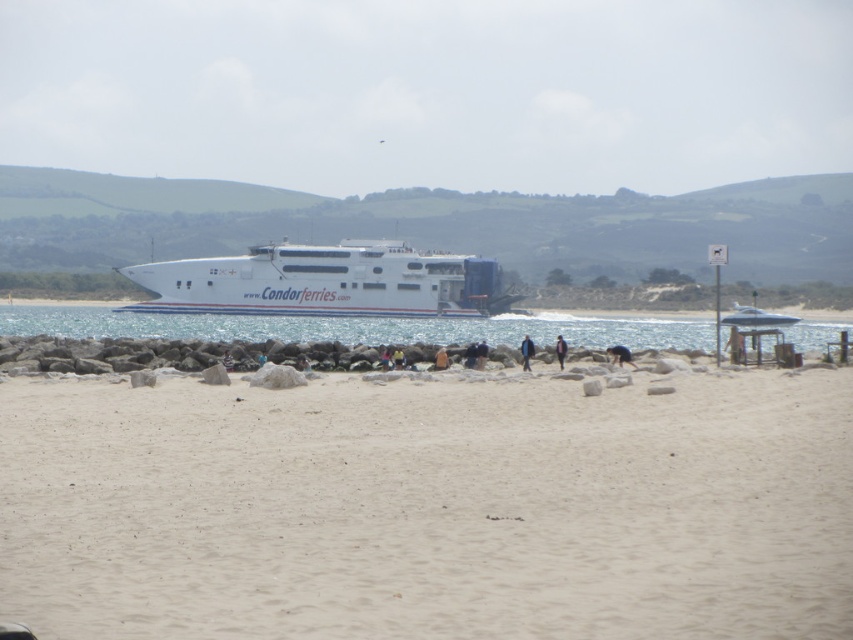
Locate an element on the screen. The height and width of the screenshot is (640, 853). white glossy cruise ship at center is located at coordinates (326, 282).

Between point (344, 252) and point (525, 348), which one is positioned in front?

Point (525, 348)

Image resolution: width=853 pixels, height=640 pixels. What are the coordinates of `white glossy cruise ship at center` in the screenshot? It's located at (326, 282).

I want to click on white glossy cruise ship at center, so click(x=326, y=282).

Between light beige sand at center and dark brown leather jacket at lower center, which one appears on the right side from the viewer's perspective?

dark brown leather jacket at lower center is more to the right.

Is light beige sand at center positioned in front of dark brown leather jacket at lower center?

Yes, it is in front of dark brown leather jacket at lower center.

Find the location of `light beige sand at center`. light beige sand at center is located at coordinates (428, 508).

Which is above, light beige sand at center or purple fabric jacket at center?

Positioned higher is purple fabric jacket at center.

Describe the element at coordinates (428, 508) in the screenshot. I see `light beige sand at center` at that location.

In order to click on light beige sand at center in this screenshot , I will do `click(428, 508)`.